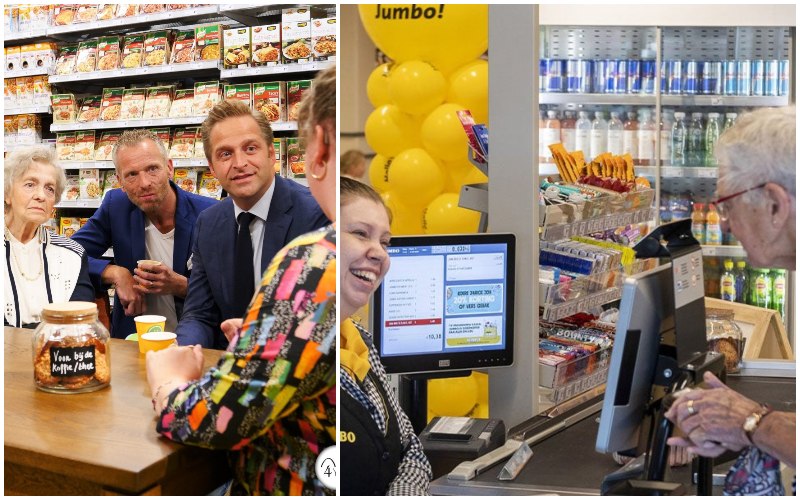
Identify the location of shelves of more items. Image resolution: width=800 pixels, height=500 pixels. (580, 215), (581, 281), (570, 370), (642, 195), (598, 352), (622, 258).